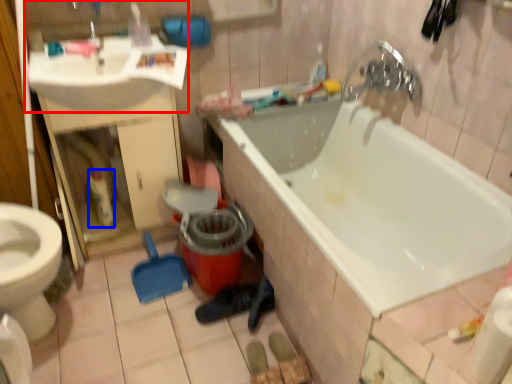
Question: Which object appears closest to the camera in this image, sink (highlighted by a red box) or cleaning product (highlighted by a blue box)?

Choices:
 (A) sink
 (B) cleaning product

Answer: (A)